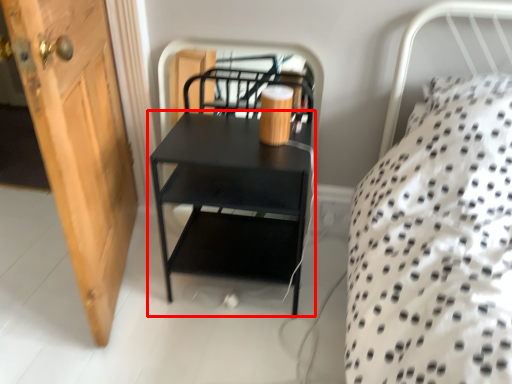
Question: From the image's perspective, where is nightstand (annotated by the red box) located in relation to door in the image?

Choices:
 (A) below
 (B) above

Answer: (A)